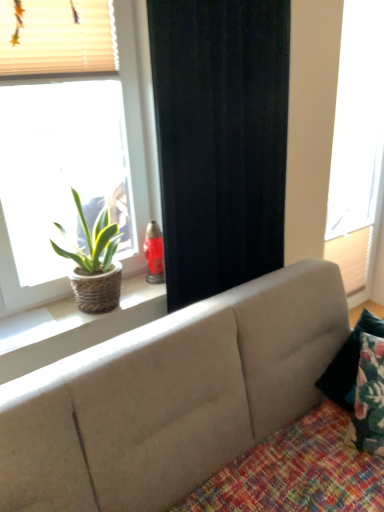
Question: Is multicolored woven quilt at lower right at the back of beige fabric couch at center?

Choices:
 (A) no
 (B) yes

Answer: (B)

Question: Would you say beige fabric couch at center is a long distance from multicolored woven quilt at lower right?

Choices:
 (A) yes
 (B) no

Answer: (B)

Question: Considering the relative sizes of beige fabric couch at center and multicolored woven quilt at lower right in the image provided, is beige fabric couch at center wider than multicolored woven quilt at lower right?

Choices:
 (A) no
 (B) yes

Answer: (B)

Question: From the image's perspective, would you say beige fabric couch at center is positioned over multicolored woven quilt at lower right?

Choices:
 (A) no
 (B) yes

Answer: (B)

Question: Is beige fabric couch at center with multicolored woven quilt at lower right?

Choices:
 (A) no
 (B) yes

Answer: (A)

Question: Is beige fabric couch at center outside of multicolored woven quilt at lower right?

Choices:
 (A) no
 (B) yes

Answer: (B)

Question: Is white matte window at right, arranged as the 2th window when viewed from the front, completely or partially outside of natural wood window sill at upper left?

Choices:
 (A) no
 (B) yes

Answer: (B)

Question: Does white matte window at right, placed as the 1th window when sorted from right to left, have a lesser height compared to natural wood window sill at upper left?

Choices:
 (A) yes
 (B) no

Answer: (B)

Question: Can you see white matte window at right, placed as the 1th window when sorted from right to left, touching natural wood window sill at upper left?

Choices:
 (A) no
 (B) yes

Answer: (A)

Question: From a real-world perspective, is white matte window at right, placed as the 1th window when sorted from right to left, under natural wood window sill at upper left?

Choices:
 (A) yes
 (B) no

Answer: (B)

Question: Could natural wood window sill at upper left be considered to be inside white matte window at right, arranged as the 2th window when viewed from the left?

Choices:
 (A) no
 (B) yes

Answer: (A)

Question: Is white matte window at right, arranged as the 2th window when viewed from the left, positioned with its back to natural wood window sill at upper left?

Choices:
 (A) no
 (B) yes

Answer: (A)

Question: From the image's perspective, is beige fabric blinds at upper left over matte wicker basket at left, the 2th window viewed from the back?

Choices:
 (A) yes
 (B) no

Answer: (A)